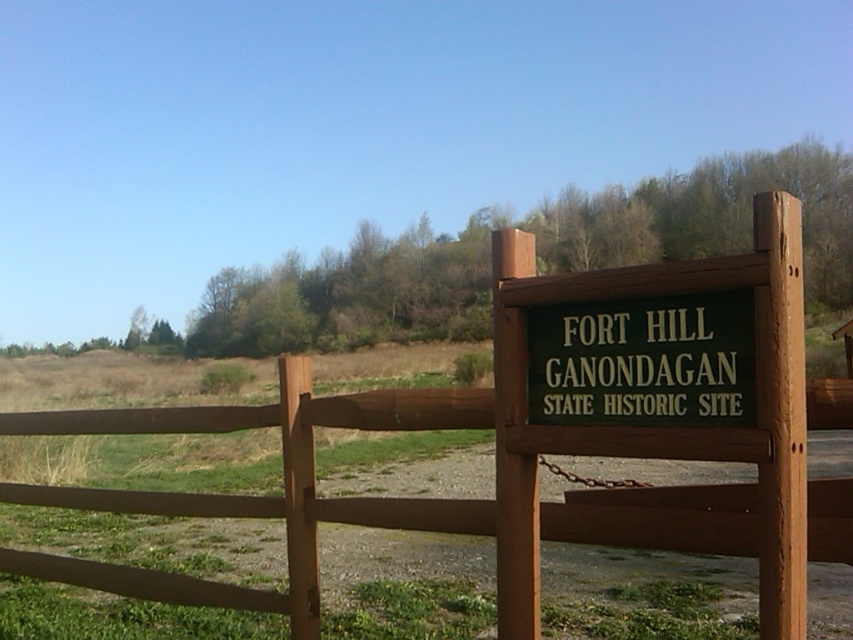
What are the coordinates of the brown wooden fence at center?

The brown wooden fence at center is located at coordinates point (519, 452).

You are a painter who needs to decide which object to paint first between the brown wooden fence at center and the green painted wood sign at right. Since you want to start with the wider object, which one should you choose?

The brown wooden fence at center should be painted first because its width surpasses the green painted wood sign at right, making it the wider object.

You are a visitor at the historic site and want to take a photo of the green painted wood sign at right without the brown wooden fence at center appearing in the frame. Is this possible given their positions?

The brown wooden fence at center is below the green painted wood sign at right, so you can position yourself to capture the sign above the fence, ensuring the fence does not block the view of the sign in your photo.